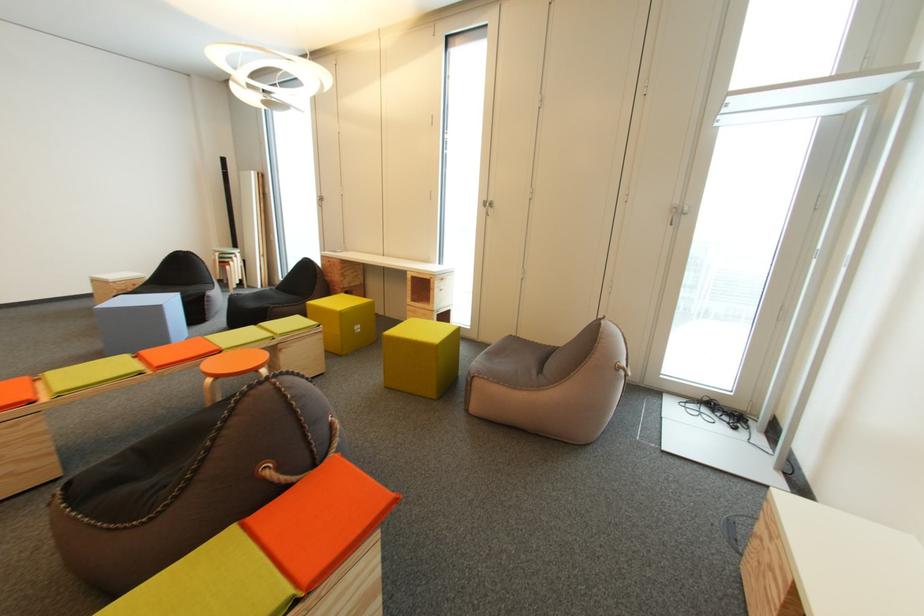
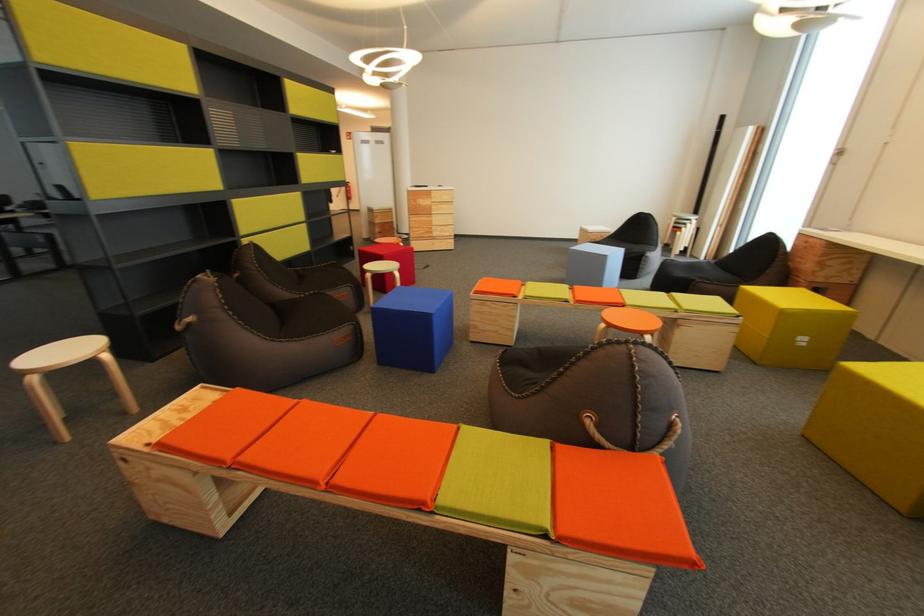
Question: Based on the continuous images, in which direction is the camera rotating? Reply with the corresponding letter.

Choices:
 (A) Left
 (B) Right
 (C) Up
 (D) Down

Answer: (A)